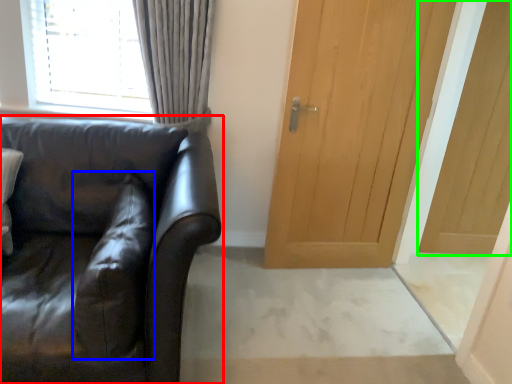
Question: Estimate the real-world distances between objects in this image. Which object is closer to studio couch (highlighted by a red box), pillow (highlighted by a blue box) or door (highlighted by a green box)?

Choices:
 (A) pillow
 (B) door

Answer: (A)